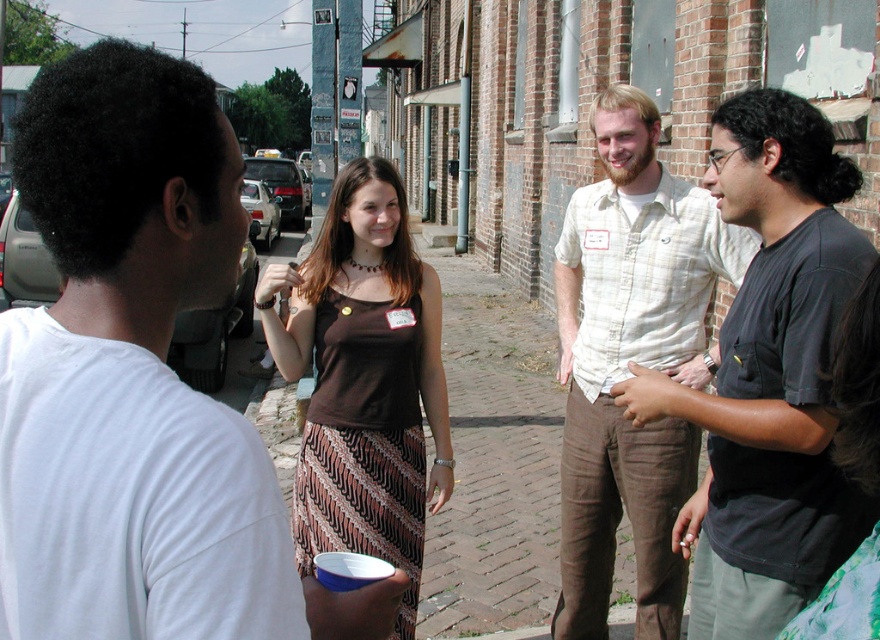
Question: Does white matte t-shirt at left appear on the right side of light beige plaid shirt at center?

Choices:
 (A) no
 (B) yes

Answer: (A)

Question: Is black cotton shirt at center smaller than brown fabric dress at center?

Choices:
 (A) no
 (B) yes

Answer: (B)

Question: Which point is closer to the camera taking this photo?

Choices:
 (A) (787, 189)
 (B) (132, 394)

Answer: (B)

Question: Which object is the farthest from the white matte t-shirt at left?

Choices:
 (A) light beige plaid shirt at center
 (B) black cotton shirt at center

Answer: (A)

Question: Which point is farther to the camera?

Choices:
 (A) (387, 208)
 (B) (132, 292)

Answer: (A)

Question: Is white matte t-shirt at left positioned at the back of brown fabric dress at center?

Choices:
 (A) yes
 (B) no

Answer: (B)